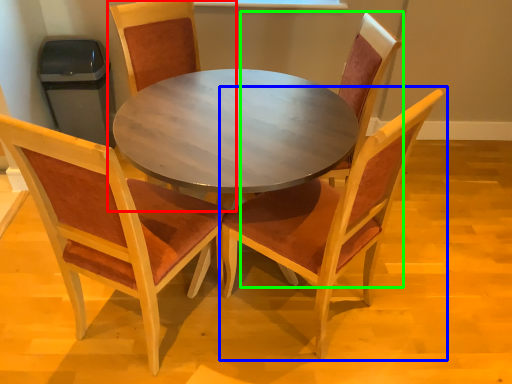
Question: Which object is positioned closest to chair (highlighted by a red box)? Select from chair (highlighted by a blue box) and chair (highlighted by a green box).

Choices:
 (A) chair
 (B) chair

Answer: (B)